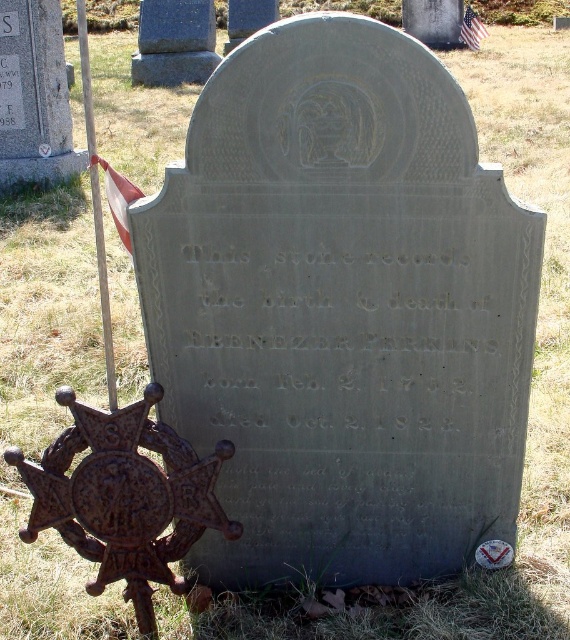
Based on the photo, who is shorter, smooth gray stone at center or red fabric flag at upper left?

red fabric flag at upper left

Measure the distance between smooth gray stone at center and camera.

41.08 feet

The image size is (570, 640). I want to click on smooth gray stone at center, so click(x=174, y=42).

Can you confirm if rusty metal star at center is shorter than smooth gray stone at center?

Yes.

Does point (93, 595) come farther from viewer compared to point (166, 19)?

That is False.

At what (x,y) coordinates should I click in order to perform the action: click on rusty metal star at center. Please return your answer as a coordinate pair (x, y). Looking at the image, I should click on (124, 497).

Between smooth gray stone at center and american flag at upper center, which one has less height?

american flag at upper center is shorter.

In the scene shown: Is smooth gray stone at center smaller than american flag at upper center?

Actually, smooth gray stone at center might be larger than american flag at upper center.

Identify the location of smooth gray stone at center. This screenshot has width=570, height=640. (174, 42).

Find the location of `smooth gray stone at center`. smooth gray stone at center is located at coordinates (174, 42).